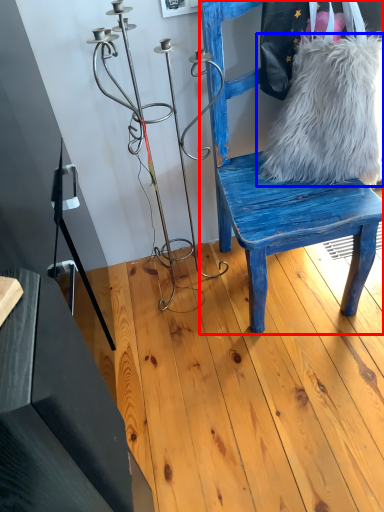
Question: Which point is further to the camera, chair (highlighted by a red box) or fur (highlighted by a blue box)?

Choices:
 (A) chair
 (B) fur

Answer: (B)